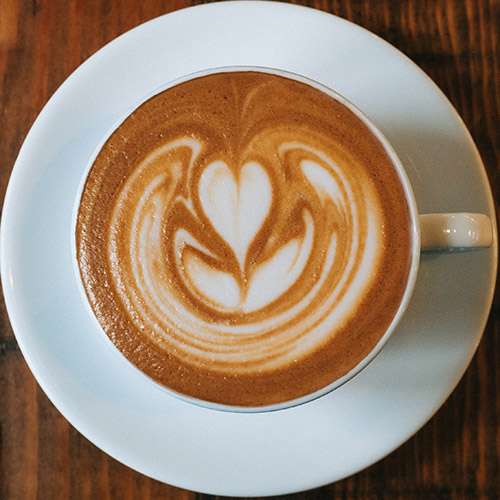
Locate an element on the screen. handle is located at coordinates (471, 219).